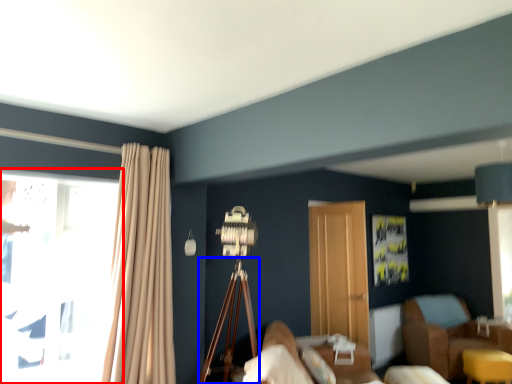
Question: Which of the following is the farthest to the observer, window (highlighted by a red box) or tripod (highlighted by a blue box)?

Choices:
 (A) window
 (B) tripod

Answer: (B)